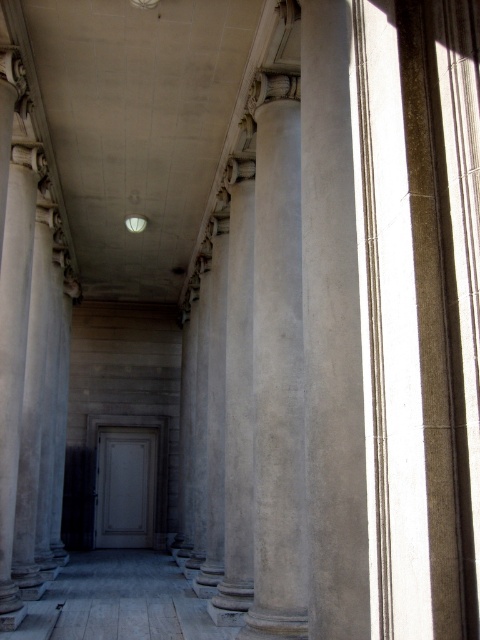
Consider the image. Is gray stone column at center to the left of white matte door at center from the viewer's perspective?

In fact, gray stone column at center is to the right of white matte door at center.

Is point (264, 442) more distant than point (101, 513)?

No, (264, 442) is closer to viewer.

Where is `gray stone column at center`? The height and width of the screenshot is (640, 480). gray stone column at center is located at coordinates (277, 368).

Who is shorter, smooth concrete column at center or white matte door at center?

white matte door at center

Who is more distant from viewer, (343, 401) or (111, 451)?

Point (111, 451)

Between point (309, 209) and point (143, 468), which one is positioned in front?

Point (309, 209) is in front.

In order to click on smooth concrete column at center in this screenshot , I will do `click(332, 332)`.

In the scene shown: Between smooth concrete column at center and gray stone column at center, which one appears on the right side from the viewer's perspective?

From the viewer's perspective, smooth concrete column at center appears more on the right side.

Who is positioned more to the left, smooth concrete column at center or gray stone column at center?

Positioned to the left is gray stone column at center.

Identify the location of smooth concrete column at center. (332, 332).

Locate an element on the screen. smooth concrete column at center is located at coordinates (332, 332).